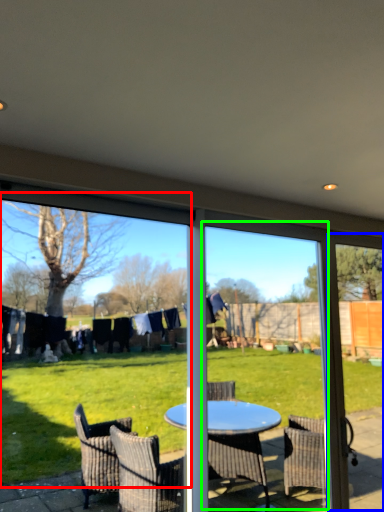
Question: Estimate the real-world distances between objects in this image. Which object is farther from window screen (highlighted by a red box), screen door (highlighted by a blue box) or screen door (highlighted by a green box)?

Choices:
 (A) screen door
 (B) screen door

Answer: (A)